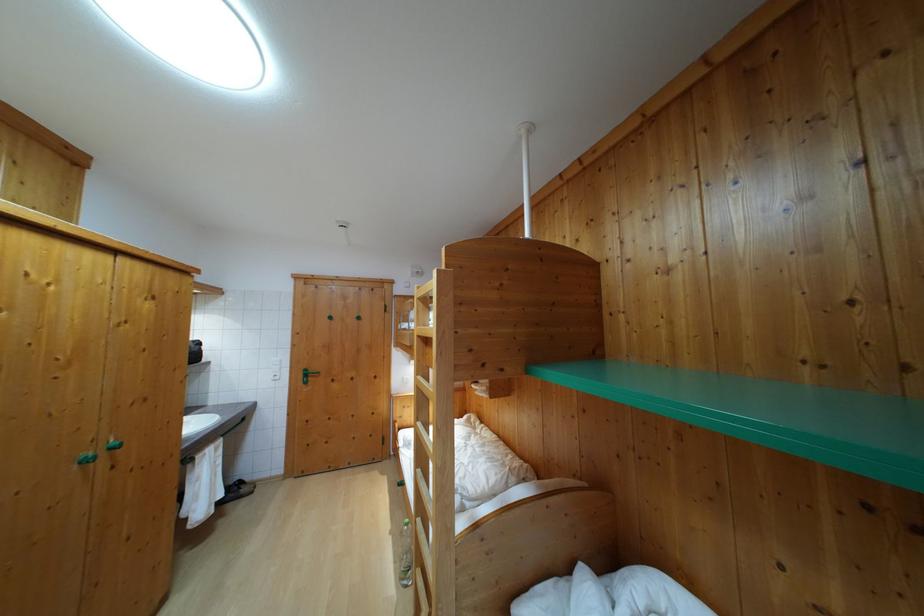
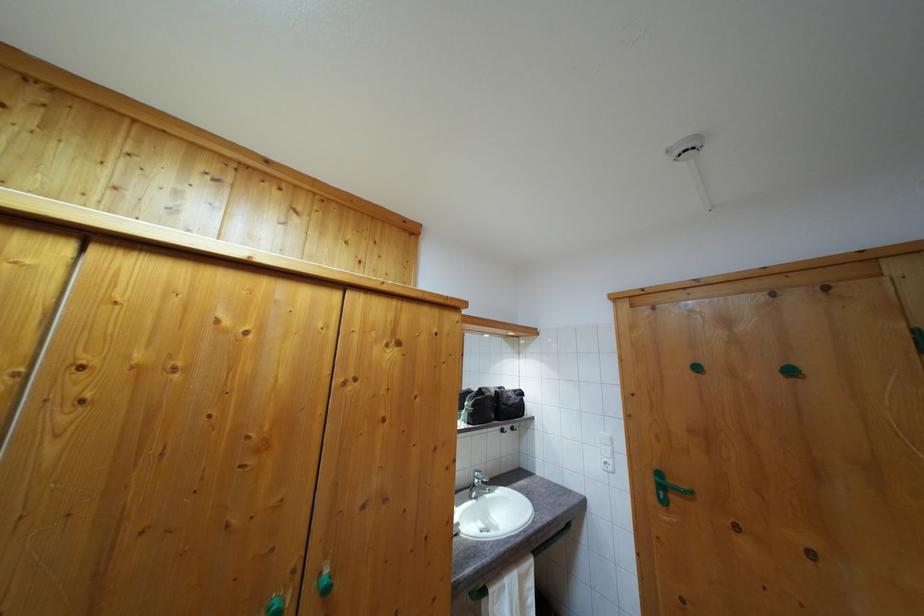
In the second image, find the point that corresponds to point (198, 349) in the first image.

(518, 398)